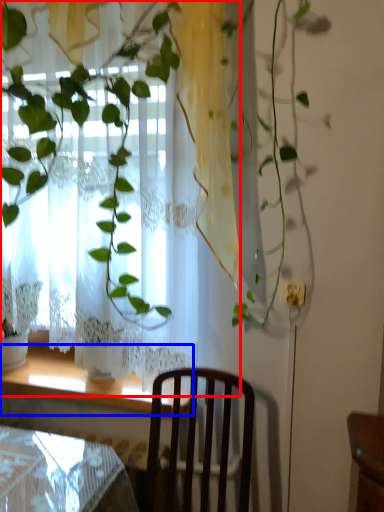
Question: Which point is closer to the camera, curtain (highlighted by a red box) or window sill (highlighted by a blue box)?

Choices:
 (A) curtain
 (B) window sill

Answer: (A)